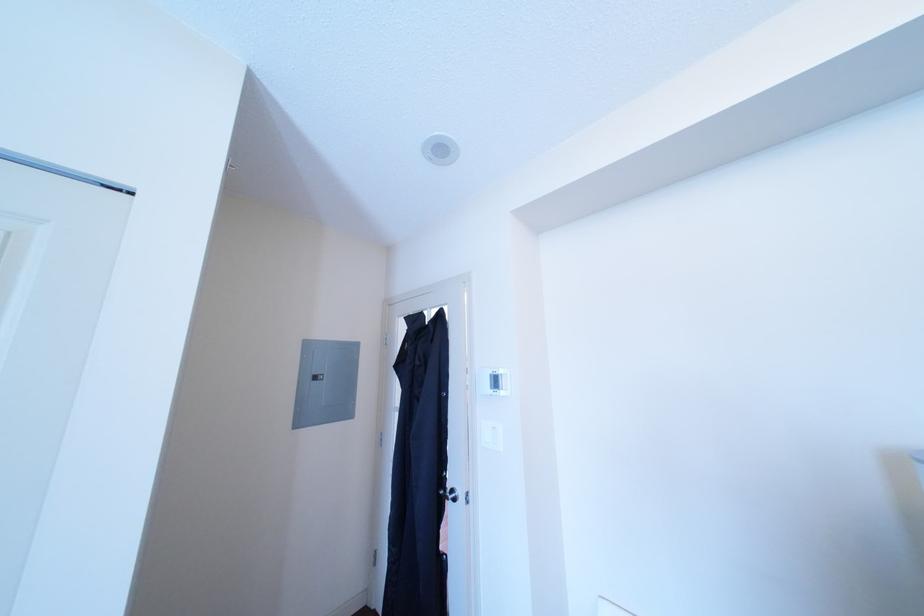
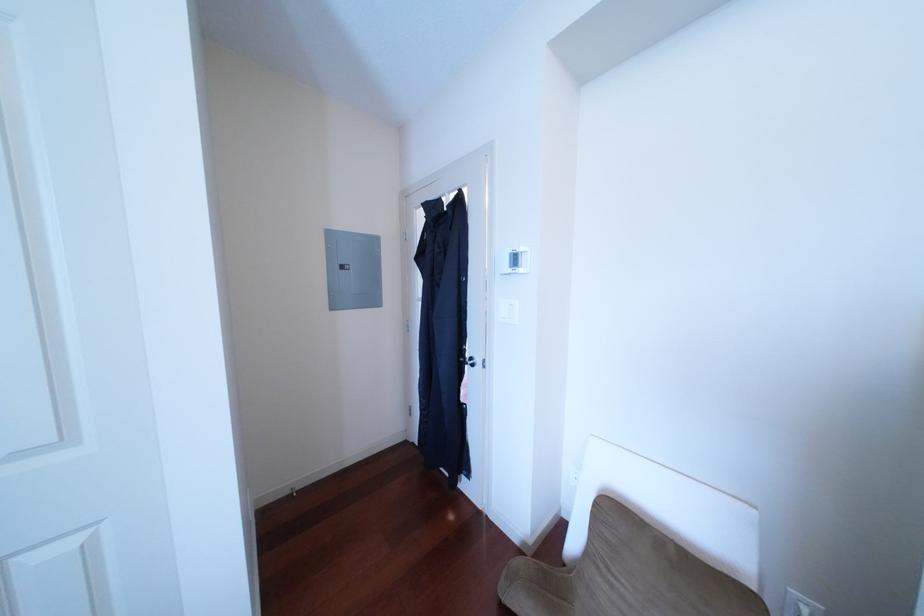
Question: The images are taken continuously from a first-person perspective. In which direction is your viewpoint rotating?

Choices:
 (A) Left
 (B) Right
 (C) Up
 (D) Down

Answer: (D)